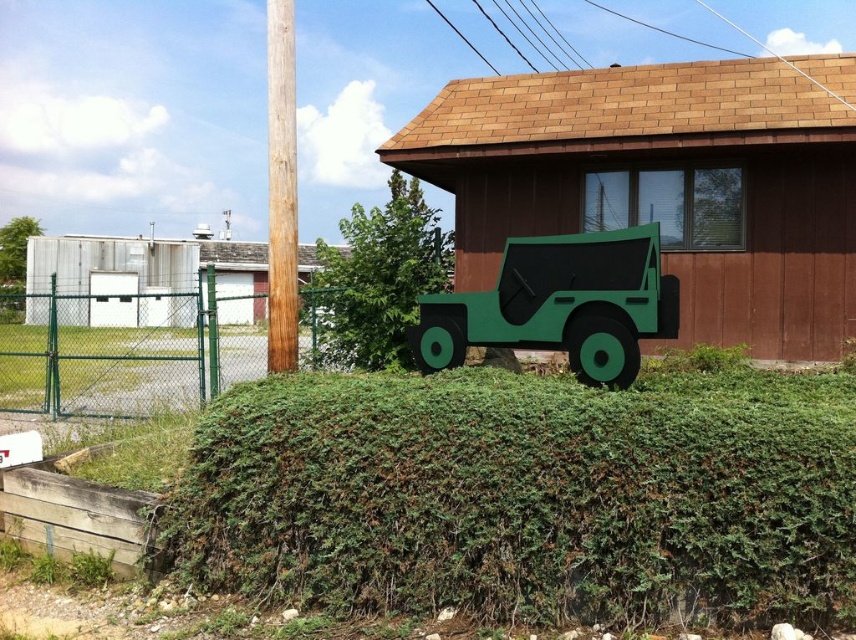
Question: Considering the relative positions of green chain-link fence at left and brown wood pole at center in the image provided, where is green chain-link fence at left located with respect to brown wood pole at center?

Choices:
 (A) left
 (B) right

Answer: (A)

Question: Is green matte bush at center to the right of brown wood pole at center from the viewer's perspective?

Choices:
 (A) yes
 (B) no

Answer: (A)

Question: Which object appears farthest from the camera in this image?

Choices:
 (A) green chain-link fence at left
 (B) green leafy hedge at center
 (C) green matte jeep at center
 (D) green matte bush at upper left

Answer: (D)

Question: Which of the following is the farthest from the observer?

Choices:
 (A) green leafy hedge at center
 (B) green matte bush at upper left

Answer: (B)

Question: Is green leafy hedge at center further to the viewer compared to brown wood pole at center?

Choices:
 (A) no
 (B) yes

Answer: (A)

Question: Estimate the real-world distances between objects in this image. Which object is closer to the brown wood pole at center?

Choices:
 (A) green matte jeep at center
 (B) green chain-link fence at left
 (C) green matte bush at center
 (D) green leafy hedge at center

Answer: (A)